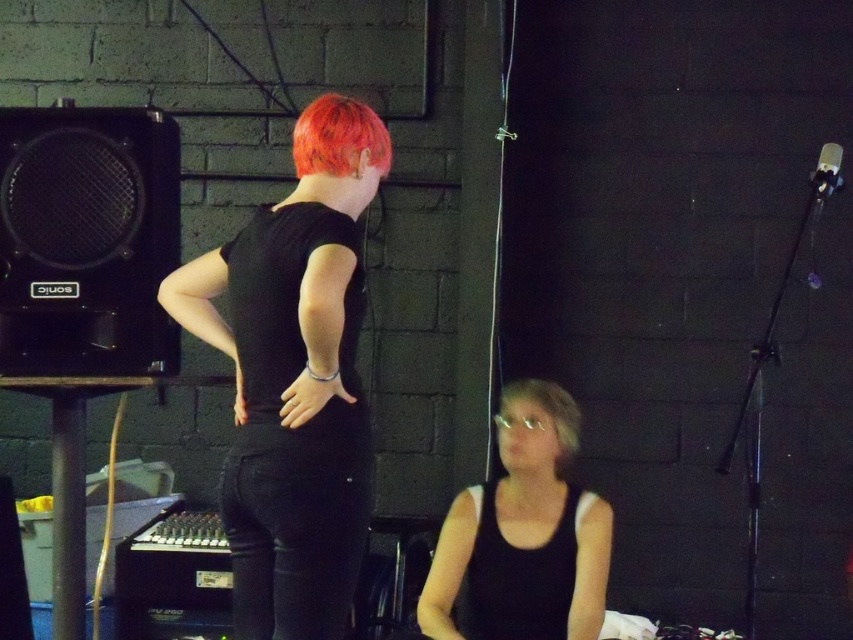
Between black matte jeans at center and black matte tank top at lower center, which one has less height?

With less height is black matte tank top at lower center.

Can you confirm if black matte jeans at center is wider than black matte tank top at lower center?

No.

Identify the location of black matte jeans at center. (294, 380).

Is bright orange hair at upper center smaller than blonde hair at lower center?

Actually, bright orange hair at upper center might be larger than blonde hair at lower center.

You are a GUI agent. You are given a task and a screenshot of the screen. Output one action in this format:
    pyautogui.click(x=<x>, y=<y>)
    Task: Click on the bright orange hair at upper center
    
    Given the screenshot: What is the action you would take?
    pyautogui.click(x=338, y=138)

I want to click on bright orange hair at upper center, so (x=338, y=138).

Find the location of a particular element. This screenshot has height=640, width=853. bright orange hair at upper center is located at coordinates (338, 138).

Is point (550, 464) closer to camera compared to point (537, 392)?

That is True.

Is black matte tank top at lower center smaller than blonde hair at lower center?

Incorrect, black matte tank top at lower center is not smaller in size than blonde hair at lower center.

Is point (537, 387) less distant than point (576, 422)?

Yes, it is in front of point (576, 422).

Locate an element on the screen. Image resolution: width=853 pixels, height=640 pixels. black matte tank top at lower center is located at coordinates (523, 534).